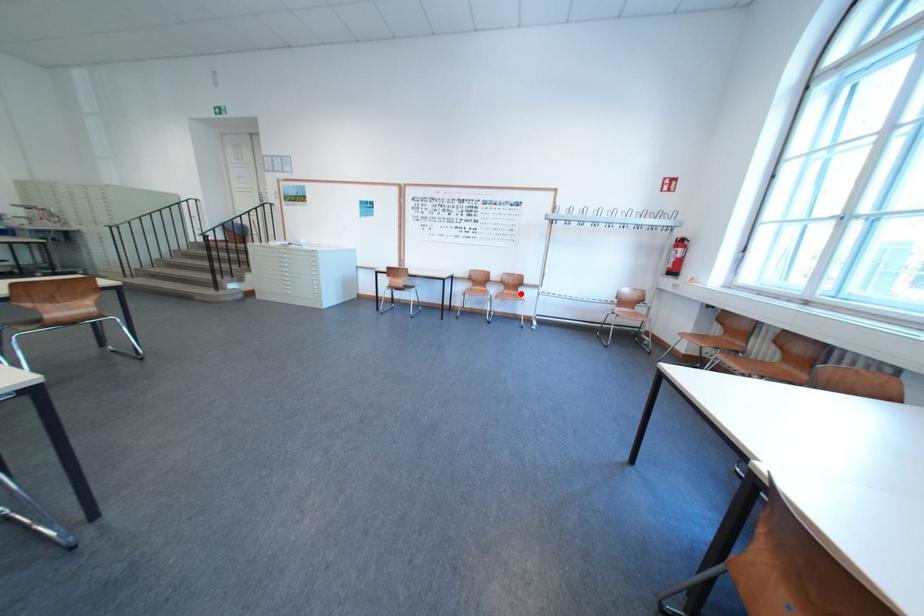
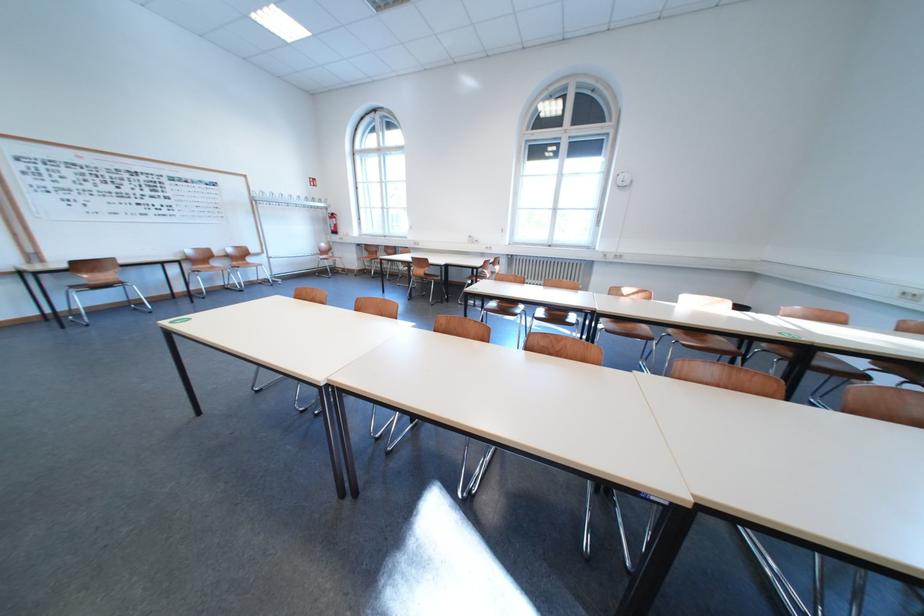
Find the pixel in the second image that matches the highlighted location in the first image.

(249, 265)